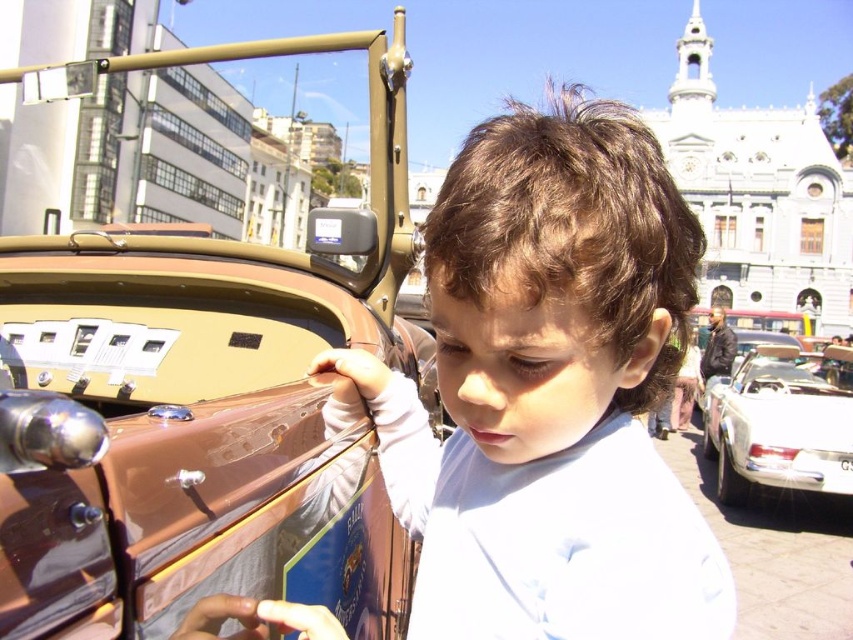
You are a photographer standing at the scene. You want to take a photo of the matte brown hair at center and the white glossy car at right. How far apart are these two objects in the image?

The matte brown hair at center is 40.98 meters from the white glossy car at right.

You are a photographer trying to capture a photo of the shiny brown car door at center and the matte brown hair at center. Which object should you focus on first if you want to ensure both are in focus without adjusting the camera settings? Please explain your reasoning based on their positions.

The shiny brown car door at center is much taller than the matte brown hair at center, so focusing on the car door first would ensure both are in focus since it is farther away and has a larger depth of field.

You are standing at the point marked as point (325, 262) in the image, which is part of an urban scene with a vintage car and a child. If you want to move closer to the vintage car, which direction should you move?

Since the point is 93.75 meters away from the viewer, moving towards the vintage car would require moving towards the center of the image where the car is located.